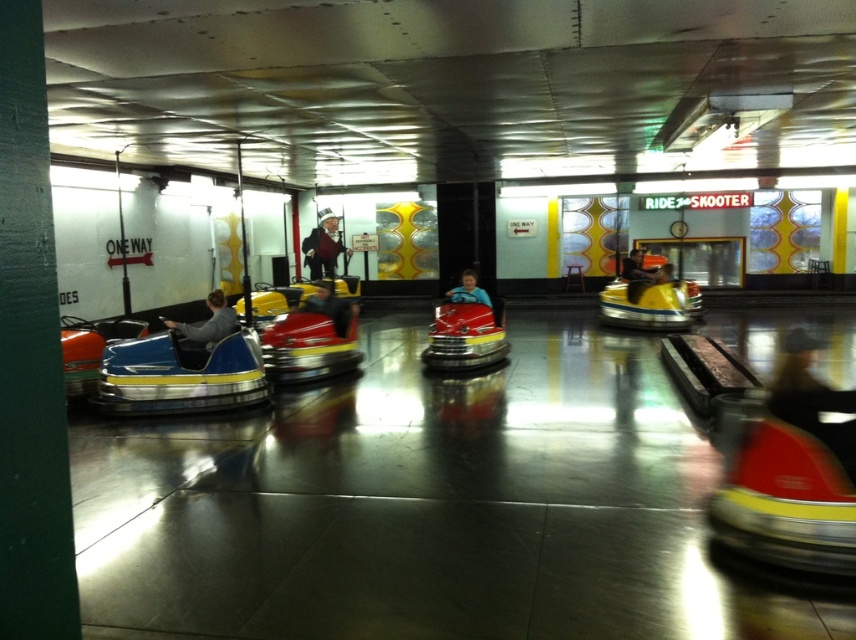
You are a parent trying to decide whether to let your child ride the yellow matte bumper car at center. The child is wearing a matte gray jacket at left. Can the child comfortably sit in the bumper car while wearing the jacket?

The yellow matte bumper car at center has a width larger than the matte gray jacket at left, so the child should be able to comfortably sit in the bumper car while wearing the jacket.

You are standing at the entrance of the bumper car ride area and want to reach the point marked as point (334, 248). If your walking speed is 1.5 meters per second, how many seconds will it take you to reach that point?

The point (334, 248) is 20.28 meters away from the viewer. At a walking speed of 1.5 meters per second, it will take 20.28 divided by 1.5, which equals approximately 13.52 seconds to reach the point.